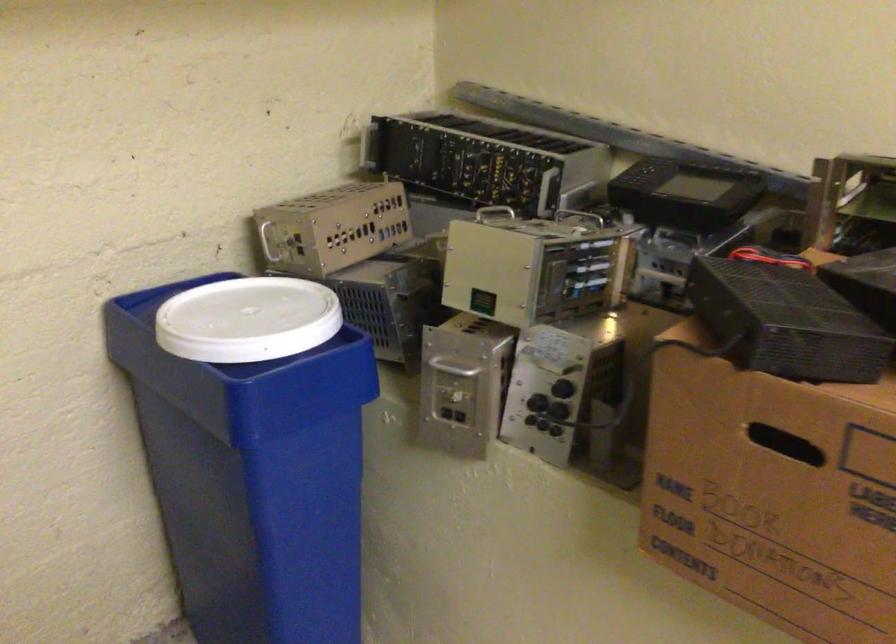
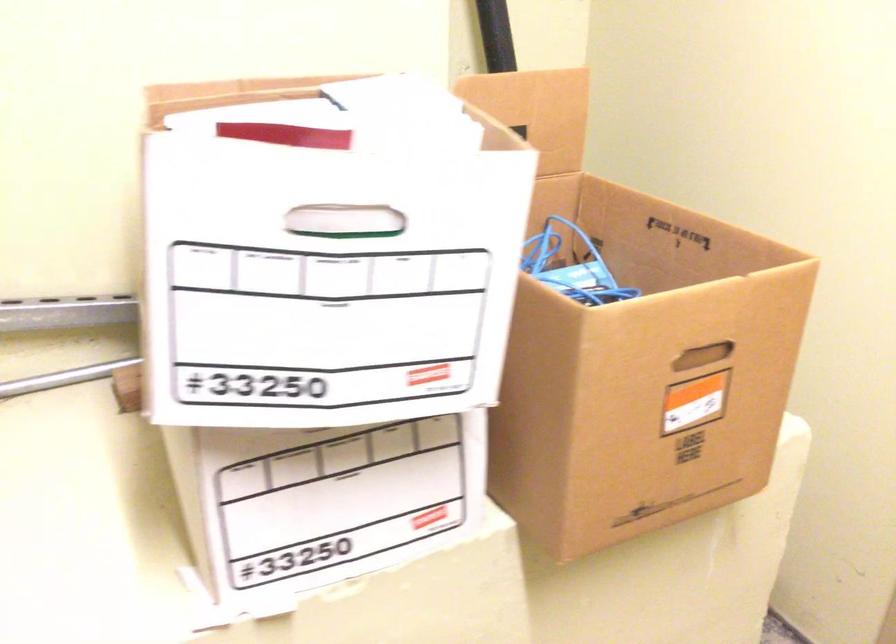
Question: The camera is either moving clockwise (left) or counter-clockwise (right) around the object. The first image is from the beginning of the video and the second image is from the end. Is the camera moving left or right when shooting the video?

Choices:
 (A) Left
 (B) Right

Answer: (A)